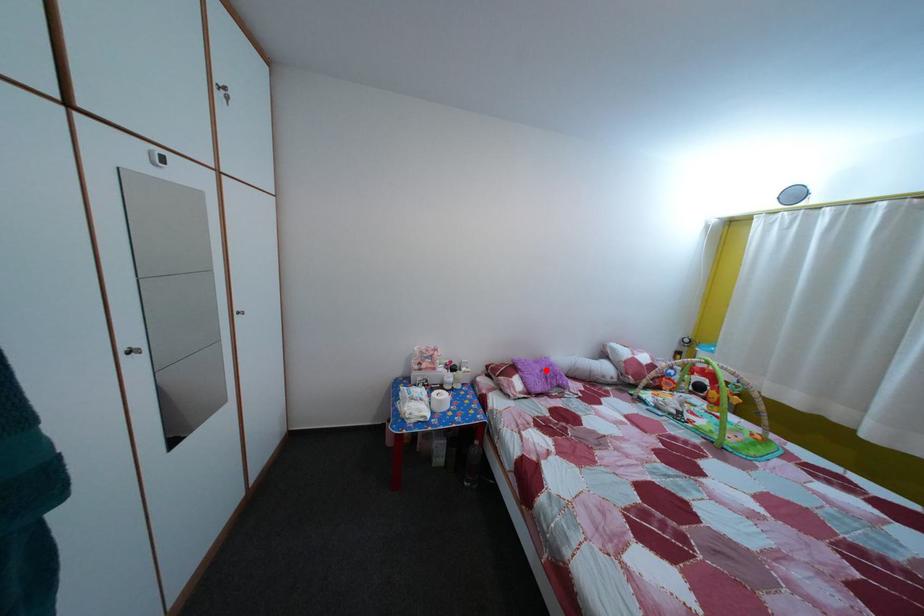
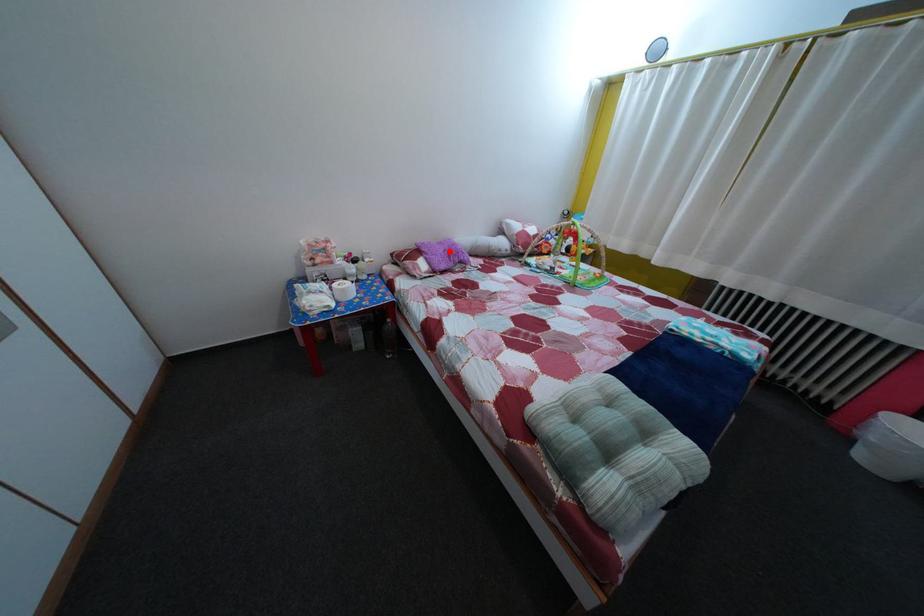
I am providing you with two images of the same scene from different viewpoints. A red point is marked on the first image and another point is marked on the second image. Are the points marked in image1 and image2 representing the same 3D position?

Yes